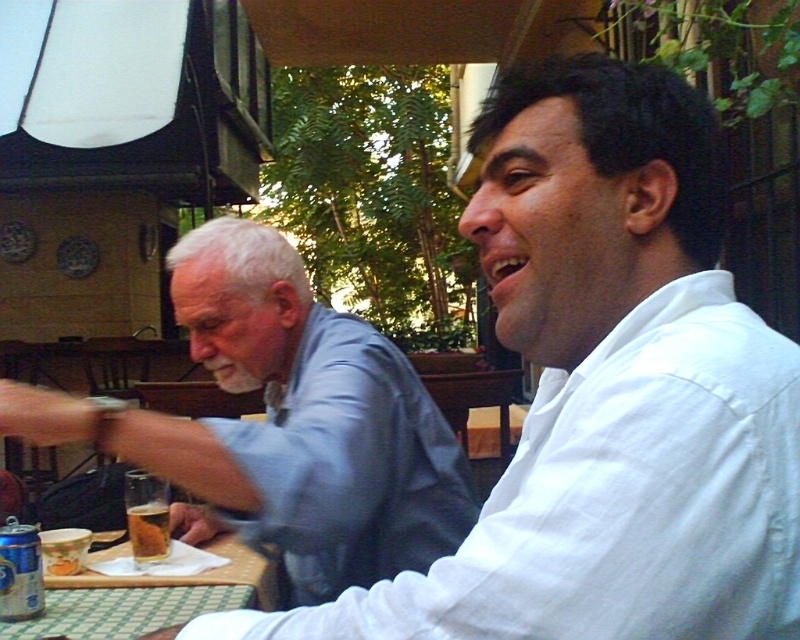
You are a photographer trying to capture a clear shot of the white cotton shirt at upper right and the green checkered tablecloth at lower left. Based on their positions, which one will appear closer to the camera in the photo?

The white cotton shirt at upper right will appear closer to the camera in the photo because it is positioned in front of the green checkered tablecloth at lower left.

You are a waiter at the outdoor cafe and need to place a new order on the table. The customer requested the blue metallic can at lower left and the golden crispy fries at lower left. Where should you place the items so that both fit on the table without overlapping?

Place the blue metallic can at lower left first since it is bigger than the golden crispy fries at lower left, then place the fries next to it to ensure they both fit without overlapping.